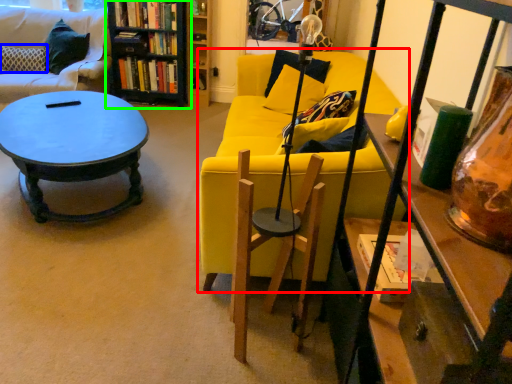
Question: Which object is the farthest from studio couch (highlighted by a red box)? Choose among these: pillow (highlighted by a blue box) or bookcase (highlighted by a green box).

Choices:
 (A) pillow
 (B) bookcase

Answer: (A)